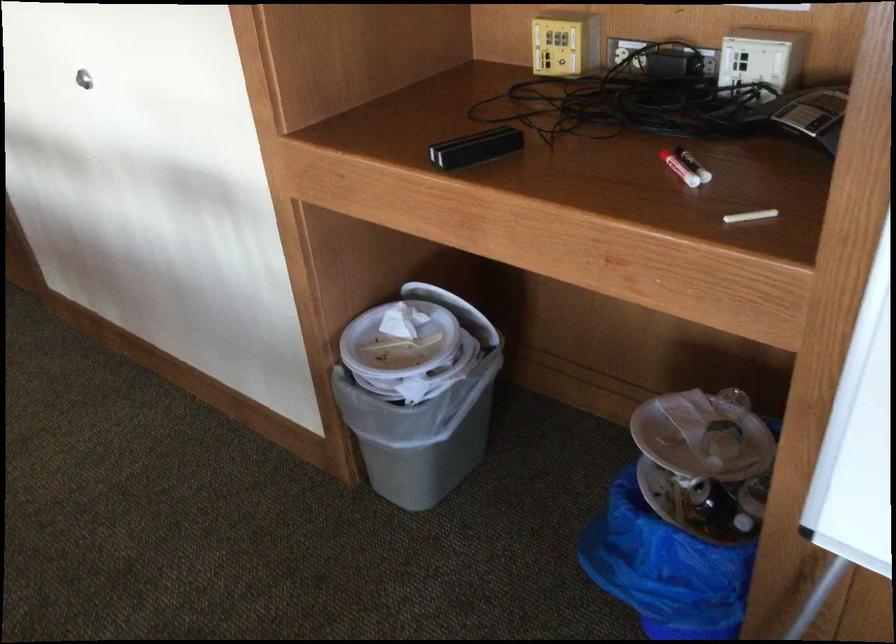
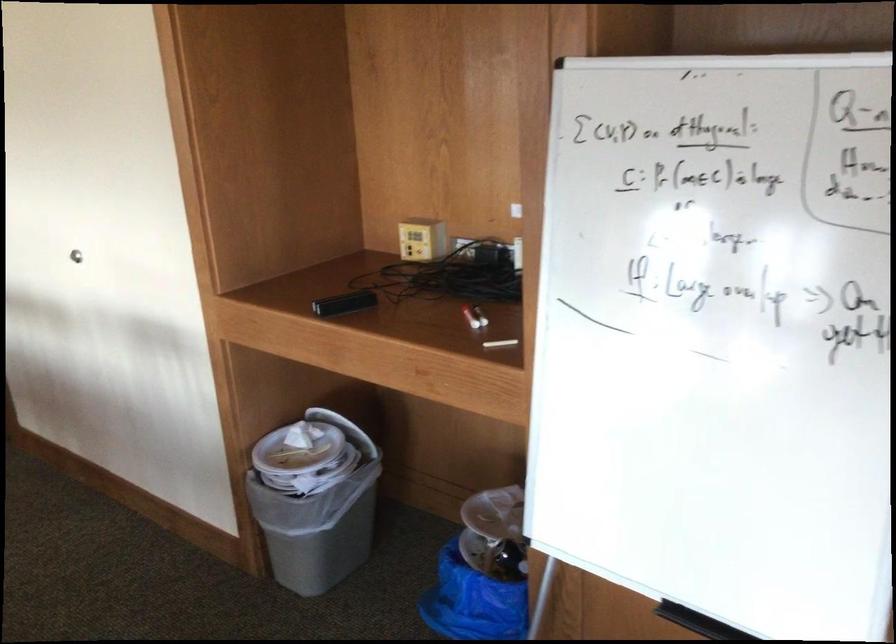
In the second image, find the point that corresponds to [666,166] in the first image.

(464, 316)